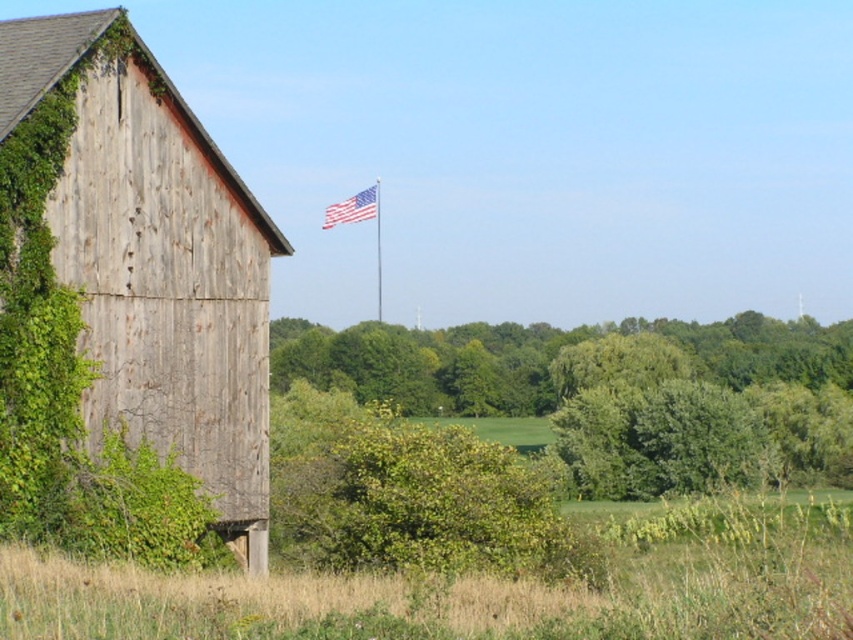
Can you confirm if green leafy tree at center is positioned to the right of american flag at upper center?

Correct, you'll find green leafy tree at center to the right of american flag at upper center.

Between point (492, 388) and point (329, 216), which one is positioned in front?

Point (329, 216) is in front.

Describe the element at coordinates (543, 358) in the screenshot. I see `green leafy tree at center` at that location.

At what (x,y) coordinates should I click in order to perform the action: click on green leafy tree at center. Please return your answer as a coordinate pair (x, y). The width and height of the screenshot is (853, 640). Looking at the image, I should click on (543, 358).

Is weathered wood barn at left to the right of american flag at upper center from the viewer's perspective?

Indeed, weathered wood barn at left is positioned on the right side of american flag at upper center.

Describe the element at coordinates (170, 288) in the screenshot. I see `weathered wood barn at left` at that location.

The height and width of the screenshot is (640, 853). Find the location of `weathered wood barn at left`. weathered wood barn at left is located at coordinates (170, 288).

Which is in front, point (241, 385) or point (323, 356)?

Point (241, 385) is in front.

Is point (86, 36) in front of point (532, 397)?

Yes, point (86, 36) is closer to viewer.

Is point (234, 419) closer to camera compared to point (405, 372)?

Yes.

At what (x,y) coordinates should I click in order to perform the action: click on weathered wood barn at left. Please return your answer as a coordinate pair (x, y). This screenshot has height=640, width=853. Looking at the image, I should click on point(170,288).